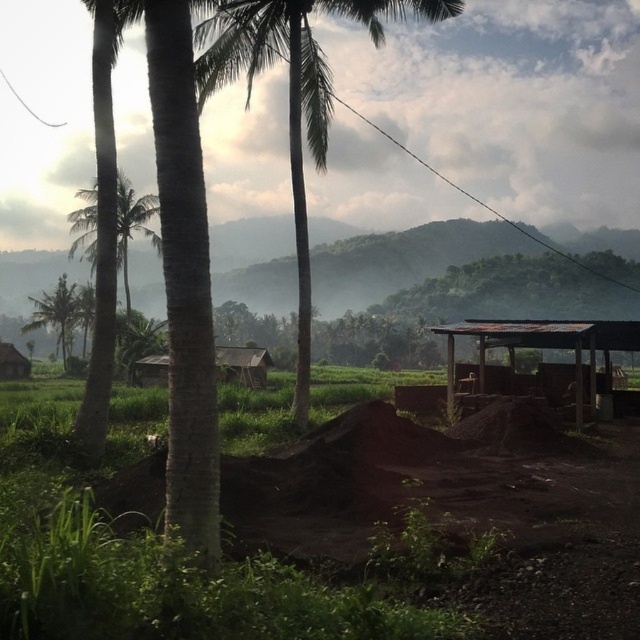
Question: Is green leafy palm tree at center to the right of green leafy palm tree at upper left from the viewer's perspective?

Choices:
 (A) yes
 (B) no

Answer: (A)

Question: Is green leafy palm tree at center to the left of brown wooden hut at lower left from the viewer's perspective?

Choices:
 (A) yes
 (B) no

Answer: (B)

Question: Can you confirm if green leafy palm tree at left is positioned above green leafy palm tree at upper left?

Choices:
 (A) no
 (B) yes

Answer: (B)

Question: Which object is the farthest from the green leafy palm tree at left?

Choices:
 (A) brown wooden hut at lower left
 (B) wooden hut at center

Answer: (A)

Question: Which of the following is the closest to the observer?

Choices:
 (A) brown wooden hut at center
 (B) brown wooden hut at lower left
 (C) wooden hut at center

Answer: (A)

Question: Which point is farther to the camera?

Choices:
 (A) (227, 369)
 (B) (308, 29)
 (C) (150, 356)
 (D) (61, 312)

Answer: (D)